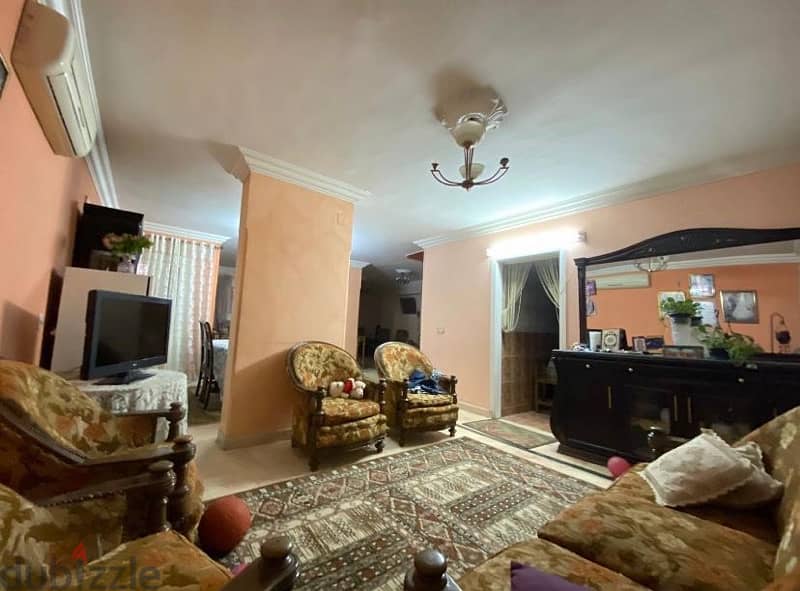
Identify the location of places to sit. The width and height of the screenshot is (800, 591). (425, 394), (354, 404), (148, 444), (142, 561), (700, 534), (588, 577), (210, 379), (201, 376).